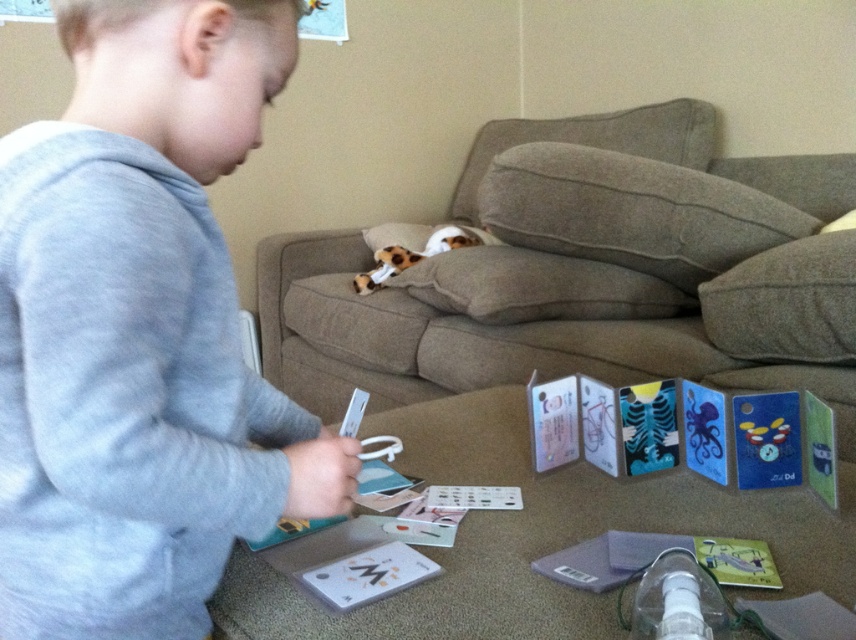
You are a photographer taking a picture of the scene from the camera position. You want to focus on the two points in the image. Which point is closer to your camera, point (355, 561) or point (406, 256)?

Point (355, 561) is closer to the camera than point (406, 256).

You are a tailor measuring fabric for a project. You need to determine which item requires more fabric between the gray cotton shirt at upper left and the white matte cards at center. Based on the image, which one would need more fabric?

The gray cotton shirt at upper left is bigger than the white matte cards at center, so it would require more fabric.